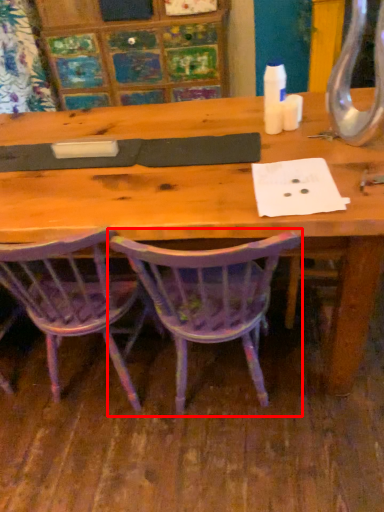
Question: Considering the relative positions of chair (annotated by the red box) and chair in the image provided, where is chair (annotated by the red box) located with respect to the staircase?

Choices:
 (A) right
 (B) left

Answer: (A)